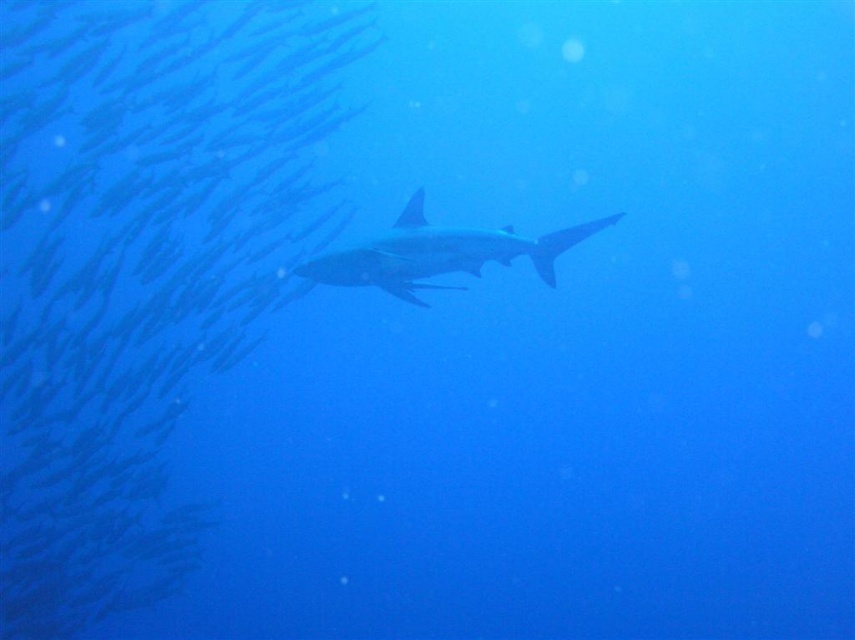
Looking at this image, you are an underwater photographer aiming to capture the translucent blue fish at upper left. Your camera is set to focus on the point at coordinates point (140,269). Will the translucent blue fish at upper left be in focus?

The translucent blue fish at upper left is located at point (140,269), so yes, the fish will be in focus as the camera is focused on that exact point.

Based on the underwater scene described, if you were to swim from the translucent blue fish at upper left to the smooth gray shark at center, in which direction would you need to move?

You would need to move to the right because the translucent blue fish at upper left is located to the left of the smooth gray shark at center.

You are a marine biologist observing the underwater scene. You notice the translucent blue fish at upper left and the smooth gray shark at center. Which of these two has a greater body length?

The translucent blue fish at upper left has a larger size compared to the smooth gray shark at center, so the translucent blue fish at upper left has a greater body length.